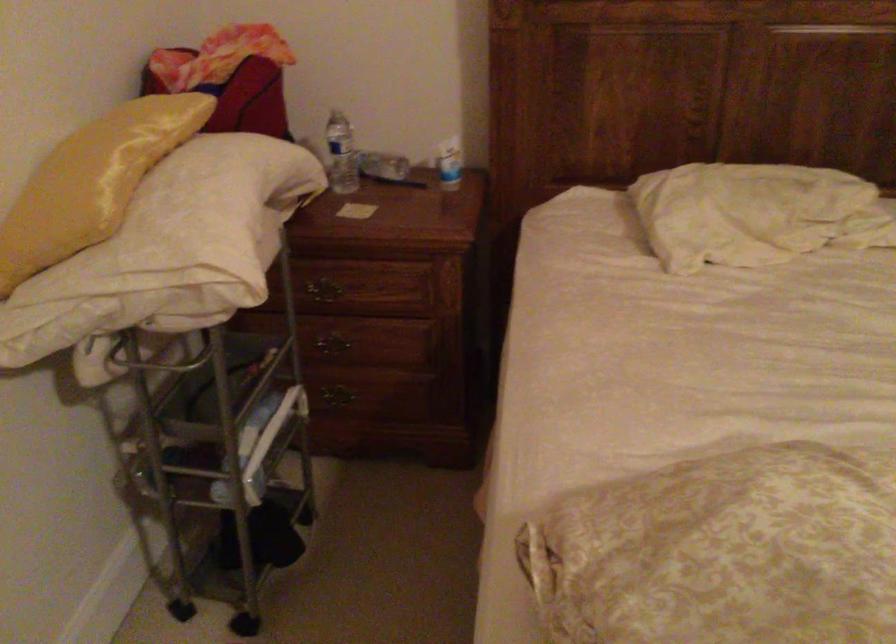
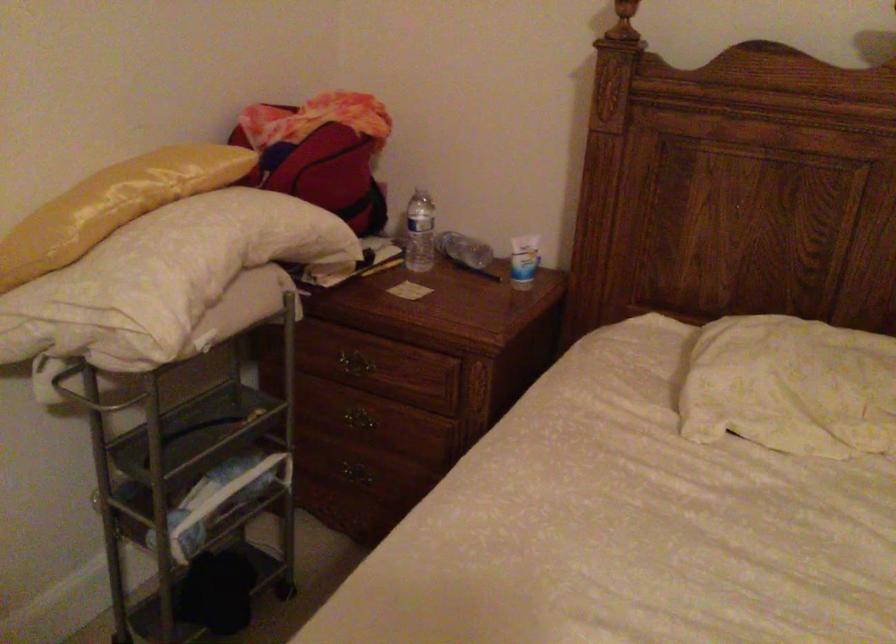
In the second image, find the point that corresponds to point 348,154 in the first image.

(419, 232)